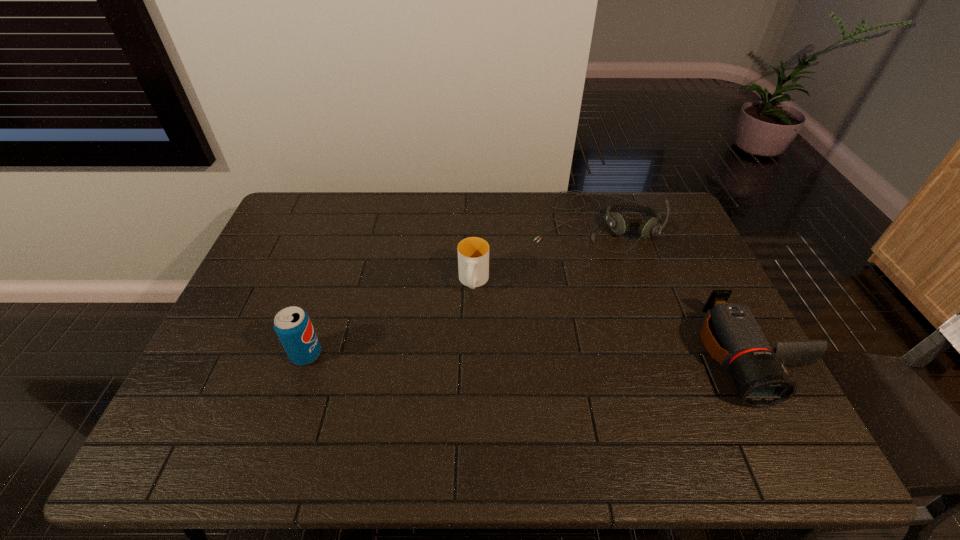
At what (x,y) coordinates should I click in order to perform the action: click on blank space located with the handle on the side of the cup. Please return your answer as a coordinate pair (x, y). Image resolution: width=960 pixels, height=540 pixels. Looking at the image, I should click on (459, 395).

Identify the location of free region located with the handle on the side of the cup. The width and height of the screenshot is (960, 540). (469, 315).

You are a GUI agent. You are given a task and a screenshot of the screen. Output one action in this format:
    pyautogui.click(x=<x>, y=<y>)
    Task: Click on the free space located with the handle on the side of the cup
    The image size is (960, 540).
    Given the screenshot: What is the action you would take?
    pyautogui.click(x=464, y=360)

Identify the location of object that is at the far edge. The image size is (960, 540). (618, 222).

At what (x,y) coordinates should I click in order to perform the action: click on object situated at the near edge. Please return your answer as a coordinate pair (x, y). This screenshot has width=960, height=540. Looking at the image, I should click on (730, 333).

Where is `camcorder situated at the right edge`? camcorder situated at the right edge is located at coordinates (x=730, y=333).

At what (x,y) coordinates should I click in order to perform the action: click on headset that is at the right edge. Please return your answer as a coordinate pair (x, y). Looking at the image, I should click on (618, 222).

Locate an element on the screen. The width and height of the screenshot is (960, 540). object present at the far right corner is located at coordinates (618, 222).

The height and width of the screenshot is (540, 960). In order to click on object at the near right corner in this screenshot , I will do `click(730, 333)`.

At what (x,y) coordinates should I click in order to perform the action: click on vacant space at the far edge of the desktop. Please return your answer as a coordinate pair (x, y). This screenshot has height=540, width=960. Looking at the image, I should click on (545, 199).